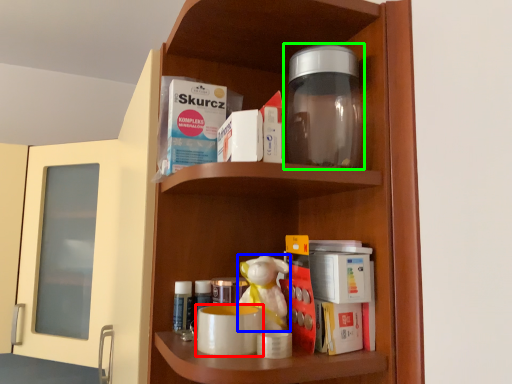
Question: Which is nearer to the mug (highlighted by a red box)? toy (highlighted by a blue box) or bottle (highlighted by a green box).

Choices:
 (A) toy
 (B) bottle

Answer: (A)